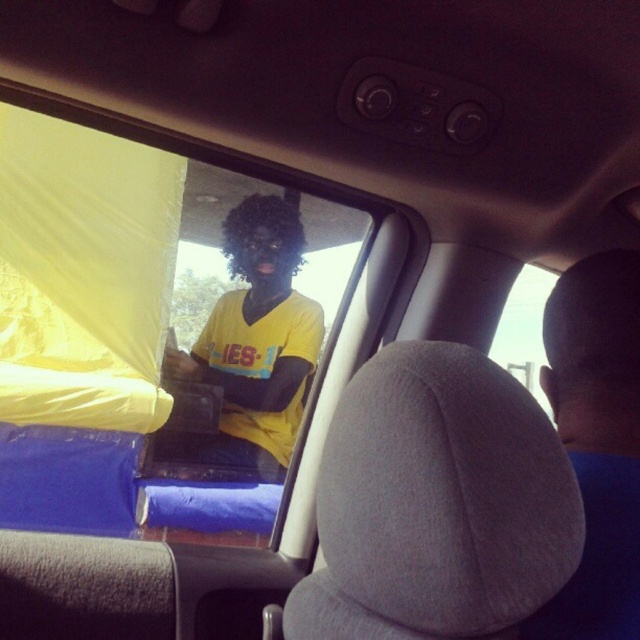
You are inside a car and looking at the passenger seat area. There is a point marked at coordinates (147, 337). What color is the fabric at that point?

The point (147, 337) marks yellow fabric at left, so the fabric at that point is yellow.

You are sitting in the passenger seat of a car and notice two yellow items inside the vehicle. The yellow fabric at left and the yellow matte shirt at center. Which of these two items is wider?

The yellow fabric at left is wider than the yellow matte shirt at center.

You are sitting in the passenger seat of a car and see a point marked at coordinates (147, 337). What color is the fabric at that point?

The point at (147, 337) indicates yellow fabric at left, so the fabric there is yellow.